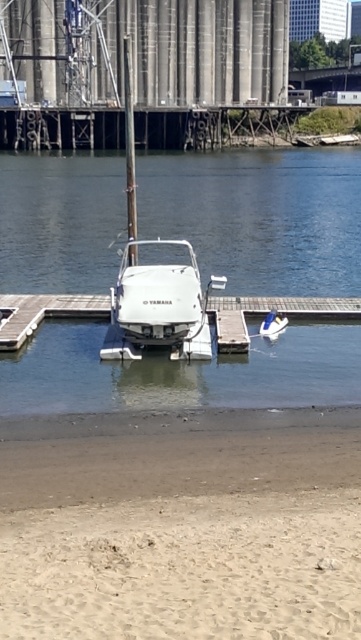
You are standing on the dock and looking at two points marked in the image. Which point, point (279, 253) or point (212, 312), is closer to your current position?

Point (212, 312) is closer to your current position because it is less further to the camera than point (279, 253).

You are a marine biologist studying the dock area. You need to place a sensor buoy in the water directly in front of the white matte boat at center. According to the coordinates provided, where should you position the buoy relative to the boat?

The white matte boat at center is located at coordinates point (158, 307). To place the sensor buoy directly in front of it, you should position the buoy at the same x coordinate 0.481 but slightly lower y coordinate, such as 0.430, to ensure it is directly ahead in the water.